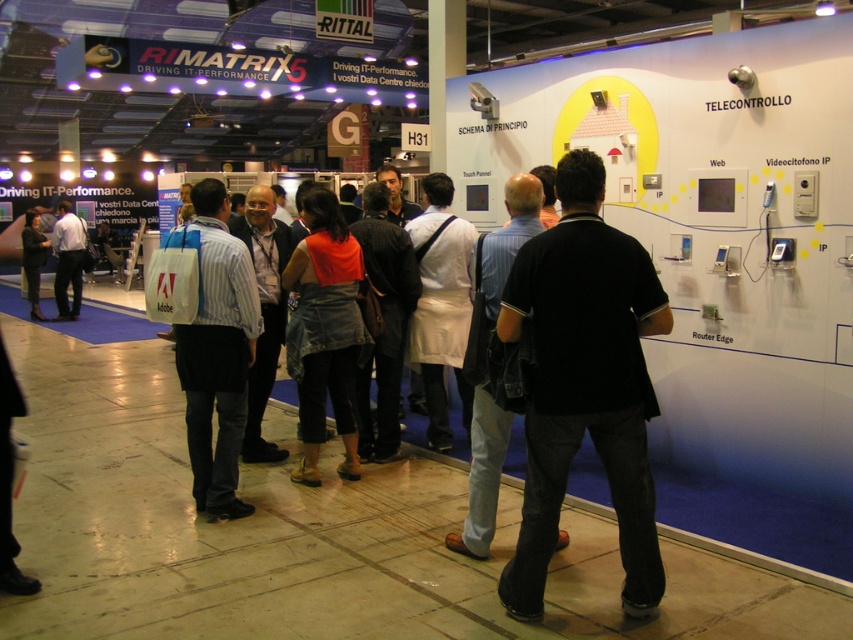
Is point (433, 225) more distant than point (78, 234)?

No, it is not.

This screenshot has height=640, width=853. I want to click on white fabric apron at center, so click(x=440, y=305).

Image resolution: width=853 pixels, height=640 pixels. What do you see at coordinates (440, 305) in the screenshot?
I see `white fabric apron at center` at bounding box center [440, 305].

I want to click on white fabric apron at center, so click(x=440, y=305).

Who is lower down, striped cotton shirt at center or denim skirt at center?

striped cotton shirt at center is below.

From the picture: Is striped cotton shirt at center in front of denim skirt at center?

Yes, it is in front of denim skirt at center.

Does point (222, 230) lie behind point (297, 365)?

No, (222, 230) is closer to viewer.

Image resolution: width=853 pixels, height=640 pixels. In order to click on striped cotton shirt at center in this screenshot , I will do `click(218, 353)`.

Can you confirm if white fabric apron at center is shorter than denim jacket at left?

No.

Measure the distance between point (419, 268) and camera.

They are 16.03 feet apart.

Between point (437, 419) and point (27, 212), which one is positioned in front?

Positioned in front is point (437, 419).

Where is `white fabric apron at center`? The width and height of the screenshot is (853, 640). white fabric apron at center is located at coordinates (440, 305).